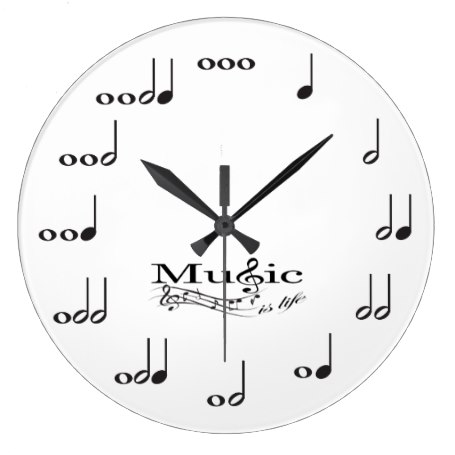
This screenshot has width=455, height=455. Find the location of `music bar`. music bar is located at coordinates (213, 300).